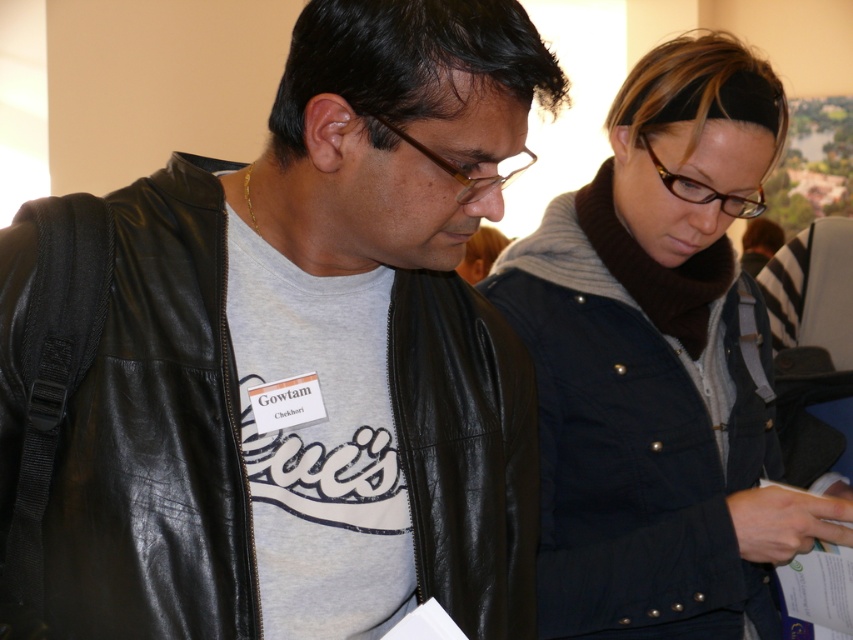
Is black leather jacket at left bigger than dark blue jacket at center?

Incorrect, black leather jacket at left is not larger than dark blue jacket at center.

Can you confirm if black leather jacket at left is smaller than dark blue jacket at center?

Yes, black leather jacket at left is smaller than dark blue jacket at center.

Between point (126, 484) and point (631, 588), which one is positioned in front?

Point (126, 484) is in front.

At what (x,y) coordinates should I click in order to perform the action: click on black leather jacket at left. Please return your answer as a coordinate pair (x, y). This screenshot has height=640, width=853. Looking at the image, I should click on (132, 416).